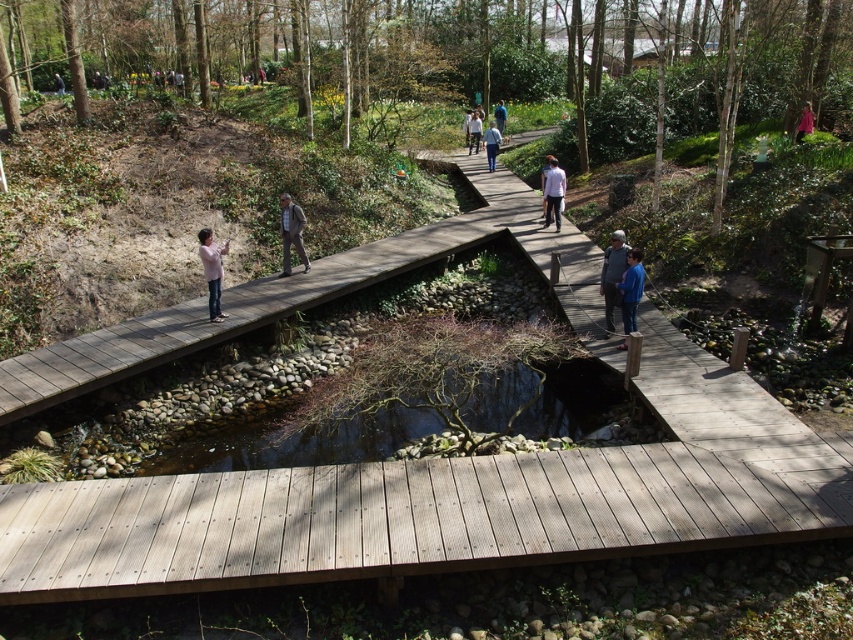
You are standing on the wooden bridge in the park scene. You notice a pink fabric at center. Where exactly is the pink fabric located in relation to the bridge sections?

The pink fabric at center is located at coordinates point (212,272).